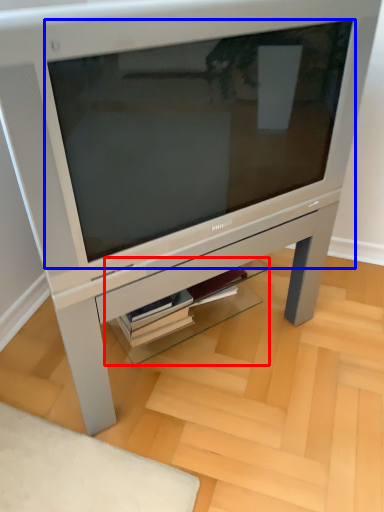
Question: Which point is closer to the camera, shelf (highlighted by a red box) or computer monitor (highlighted by a blue box)?

Choices:
 (A) shelf
 (B) computer monitor

Answer: (B)